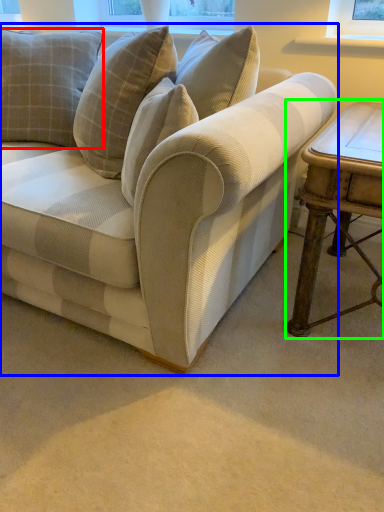
Question: Which object is positioned farthest from pillow (highlighted by a red box)? Select from studio couch (highlighted by a blue box) and table (highlighted by a green box).

Choices:
 (A) studio couch
 (B) table

Answer: (B)